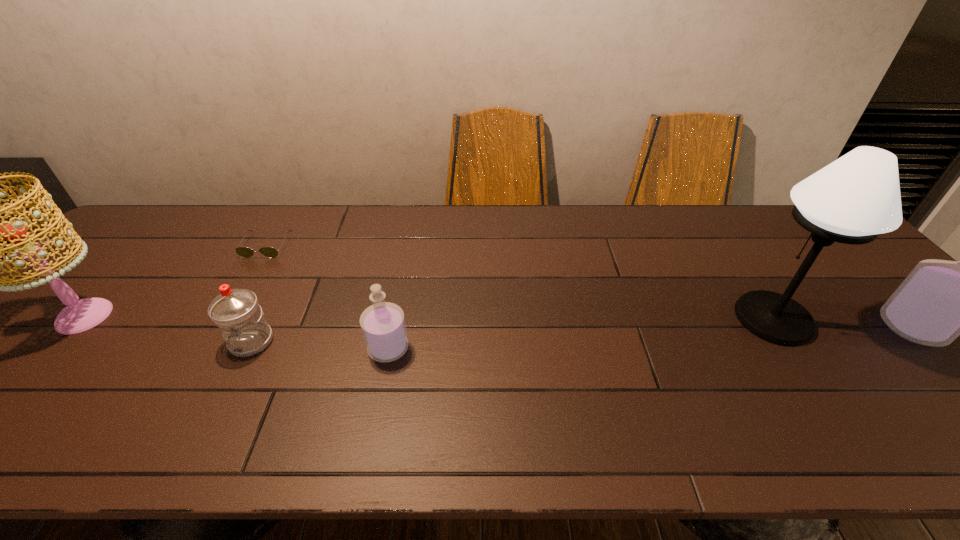
At what (x,y) coordinates should I click in order to perform the action: click on the fourth object from left to right. Please return your answer as a coordinate pair (x, y). The image size is (960, 540). Looking at the image, I should click on (383, 326).

Find the location of a particular element. the left perfume is located at coordinates (383, 326).

At what (x,y) coordinates should I click in order to perform the action: click on the farthest object. Please return your answer as a coordinate pair (x, y). This screenshot has height=540, width=960. Looking at the image, I should click on (245, 252).

Locate an element on the screen. This screenshot has width=960, height=540. the shortest object is located at coordinates (245, 252).

Locate an element on the screen. the fifth shortest object is located at coordinates (81, 315).

Locate an element on the screen. lampshade is located at coordinates (81, 315).

This screenshot has height=540, width=960. I want to click on the tallest object, so click(857, 197).

The width and height of the screenshot is (960, 540). I want to click on the second object from right to left, so click(x=857, y=197).

Where is `water bottle`? This screenshot has height=540, width=960. water bottle is located at coordinates (244, 328).

Identify the location of vacant space located 0.110m on the front of the third object from right to left. This screenshot has height=540, width=960. (376, 408).